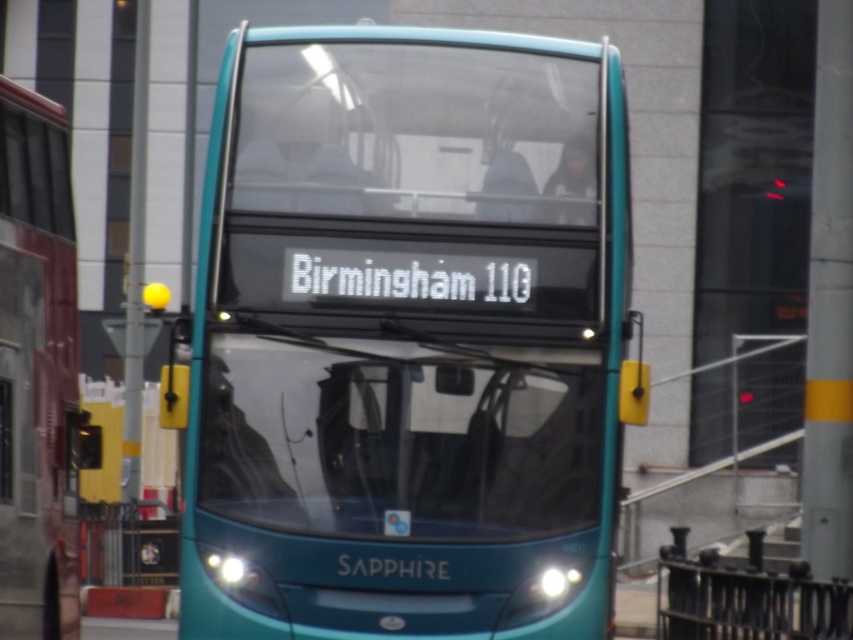
Between point (244, 468) and point (3, 132), which one is positioned in front?

Positioned in front is point (244, 468).

Who is lower down, teal glossy bus at center or teal glossy bus at left?

teal glossy bus at left is below.

Identify the location of teal glossy bus at center. (408, 337).

Where is `teal glossy bus at center`? This screenshot has height=640, width=853. teal glossy bus at center is located at coordinates (408, 337).